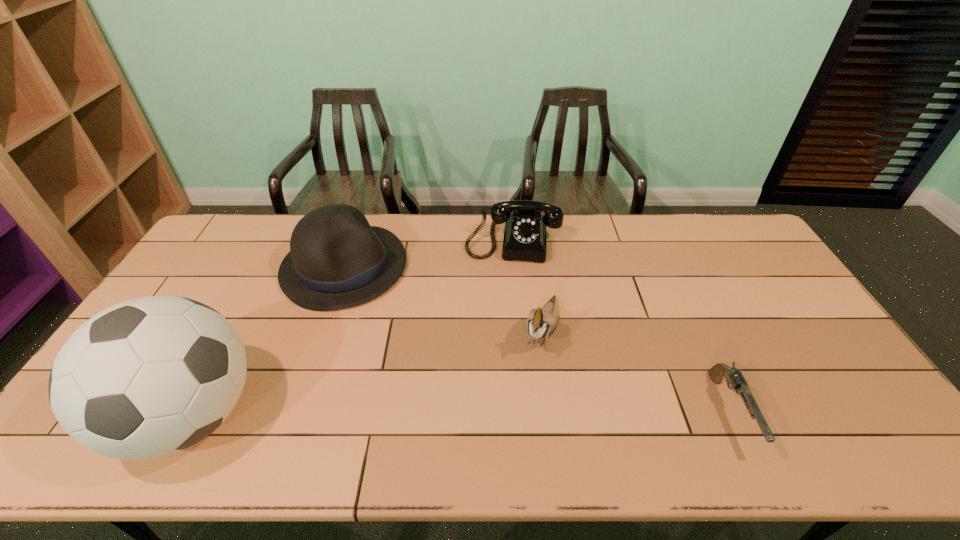
You are a GUI agent. You are given a task and a screenshot of the screen. Output one action in this format:
    pyautogui.click(x=<x>, y=<y>)
    Task: Click on the vacant region located on the front-facing side of the bowler hat
    This screenshot has height=540, width=960.
    Given the screenshot: What is the action you would take?
    pyautogui.click(x=452, y=352)

This screenshot has height=540, width=960. Identify the location of free space located 0.130m on the front-facing side of the bowler hat. (410, 319).

Where is `vacant area situated on the front-facing side of the bowler hat`? The width and height of the screenshot is (960, 540). vacant area situated on the front-facing side of the bowler hat is located at coordinates (444, 346).

You are a GUI agent. You are given a task and a screenshot of the screen. Output one action in this format:
    pyautogui.click(x=<x>, y=<y>)
    Task: Click on the vacant space situated 0.160m on the dial of the second shortest object
    The width and height of the screenshot is (960, 540).
    Given the screenshot: What is the action you would take?
    pyautogui.click(x=506, y=298)

Locate an element on the screen. The width and height of the screenshot is (960, 540). free space located on the dial of the second shortest object is located at coordinates pos(505,308).

Identify the location of free spot located on the dial of the second shortest object. This screenshot has height=540, width=960. (506, 303).

The width and height of the screenshot is (960, 540). In order to click on bowler hat positioned at the far edge in this screenshot , I will do `click(337, 260)`.

You are a GUI agent. You are given a task and a screenshot of the screen. Output one action in this format:
    pyautogui.click(x=<x>, y=<y>)
    Task: Click on the telephone that is positioned at the far edge
    This screenshot has height=540, width=960.
    Given the screenshot: What is the action you would take?
    pyautogui.click(x=524, y=239)

Where is `soccer ball located at the near edge`? soccer ball located at the near edge is located at coordinates (148, 377).

In order to click on gun that is at the near edge in this screenshot , I will do `click(735, 378)`.